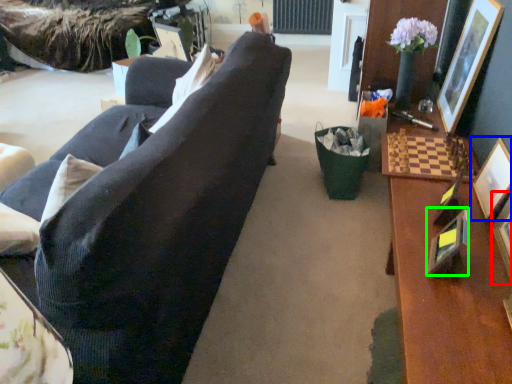
Question: Estimate the real-world distances between objects in this image. Which object is farther from picture frame (highlighted by a red box), picture frame (highlighted by a blue box) or picture frame (highlighted by a green box)?

Choices:
 (A) picture frame
 (B) picture frame

Answer: (B)